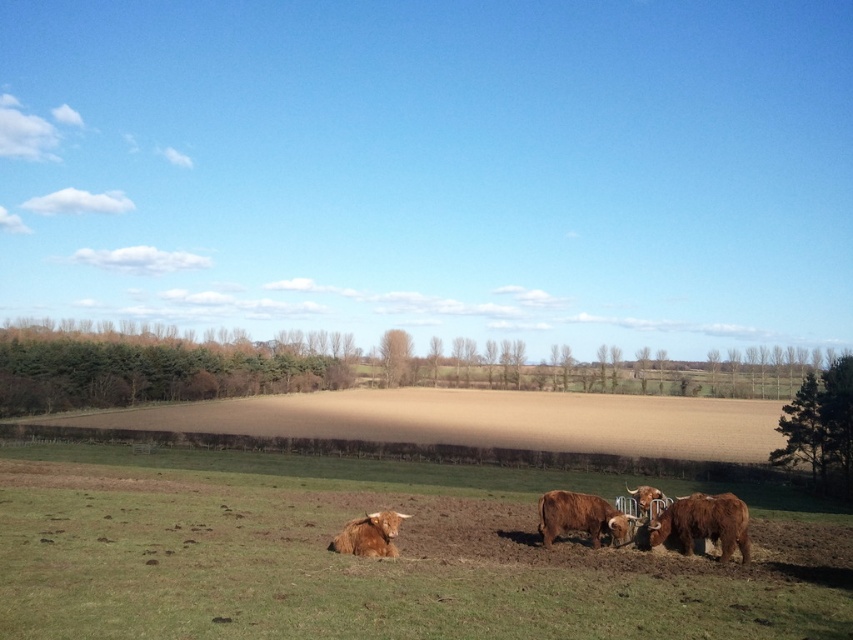
Question: Is green grassy field at lower center positioned before brown furry bull at lower center?

Choices:
 (A) yes
 (B) no

Answer: (A)

Question: Which point is closer to the camera?

Choices:
 (A) (541, 516)
 (B) (616, 572)
 (C) (695, 497)

Answer: (B)

Question: Which point appears closest to the camera in this image?

Choices:
 (A) (347, 536)
 (B) (843, 556)
 (C) (550, 420)
 (D) (715, 538)

Answer: (A)

Question: Is brown furry bull at center above brown furry bull at lower center?

Choices:
 (A) yes
 (B) no

Answer: (B)

Question: Considering the real-world distances, which object is closest to the green grassy field at lower center?

Choices:
 (A) brown soil at center
 (B) brown furry bull at lower right
 (C) brown furry bull at lower center

Answer: (B)

Question: Does brown soil at center have a lesser width compared to brown furry bull at center?

Choices:
 (A) yes
 (B) no

Answer: (B)